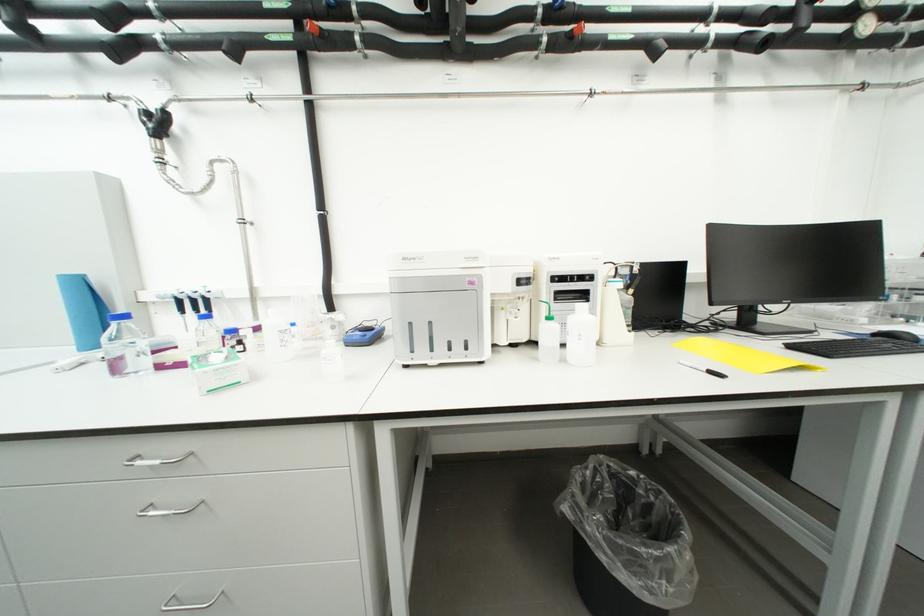
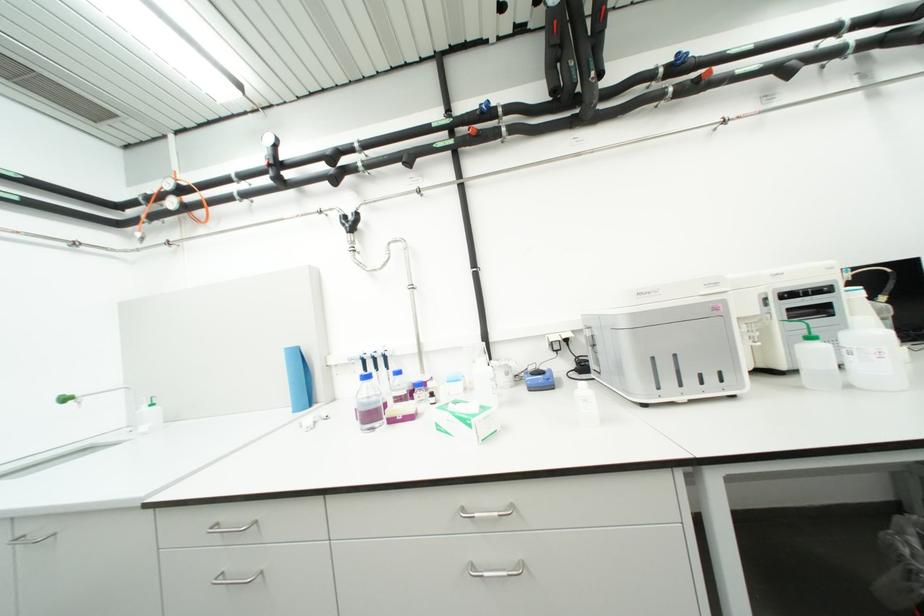
Locate, in the second image, the point that corresponds to the point at 159,516 in the first image.

(493, 575)